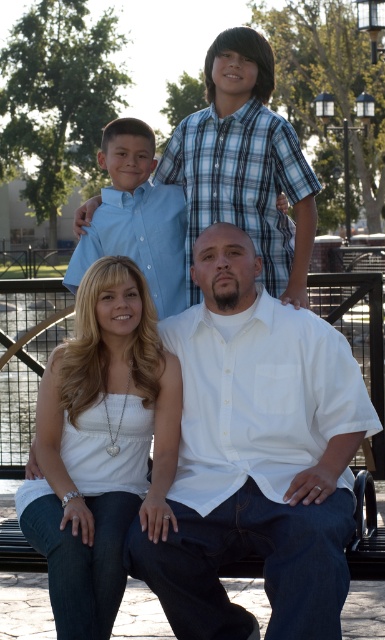
Question: Is white cotton shirt at center behind white matte tank top at center?

Choices:
 (A) yes
 (B) no

Answer: (B)

Question: Which of the following is the closest to the observer?

Choices:
 (A) (334, 515)
 (B) (90, 481)

Answer: (A)

Question: Does white cotton shirt at center appear on the left side of white matte tank top at center?

Choices:
 (A) no
 (B) yes

Answer: (A)

Question: Which point appears farthest from the camera in this image?

Choices:
 (A) (311, 440)
 (B) (33, 545)

Answer: (A)

Question: Can you confirm if white cotton shirt at center is bigger than white matte tank top at center?

Choices:
 (A) yes
 (B) no

Answer: (A)